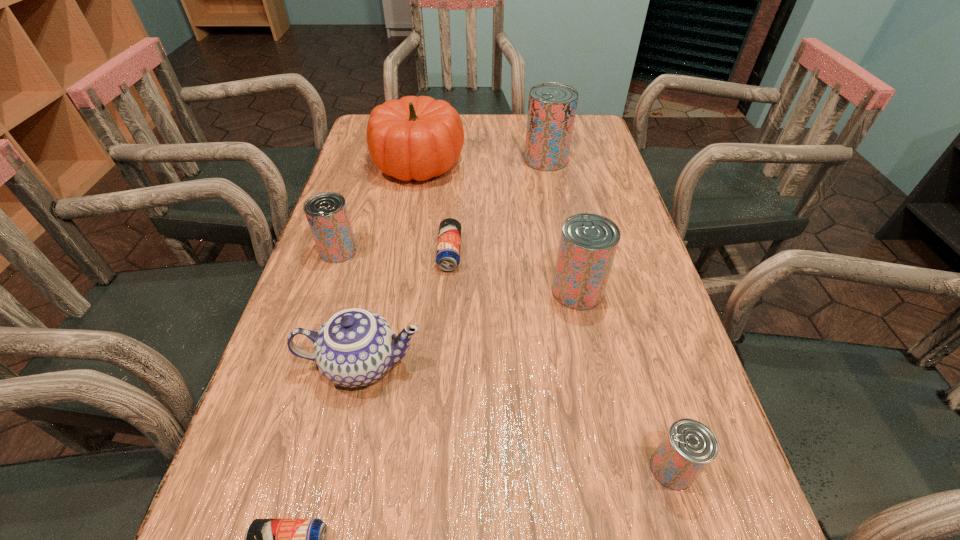
Locate an element on the screen. beer can positioned at the far edge is located at coordinates (552, 106).

Image resolution: width=960 pixels, height=540 pixels. In order to click on pumpkin situated at the far edge in this screenshot , I will do `click(419, 138)`.

Locate an element on the screen. The width and height of the screenshot is (960, 540). pumpkin present at the left edge is located at coordinates (419, 138).

Locate an element on the screen. Image resolution: width=960 pixels, height=540 pixels. chinaware at the left edge is located at coordinates (355, 347).

At what (x,y) coordinates should I click in order to perform the action: click on beer can located at the left edge. Please return your answer as a coordinate pair (x, y). The image size is (960, 540). Looking at the image, I should click on (327, 214).

Identify the location of object located at the far left corner. The width and height of the screenshot is (960, 540). (419, 138).

Where is `object situated at the far right corner`? object situated at the far right corner is located at coordinates (552, 106).

Identify the location of vacant space at the far edge. The image size is (960, 540). (506, 121).

The image size is (960, 540). What are the coordinates of `vacant space at the left edge of the desktop` in the screenshot? It's located at (269, 372).

In the image, there is a desktop. At what (x,y) coordinates should I click in order to perform the action: click on free space at the right edge. Please return your answer as a coordinate pair (x, y). The width and height of the screenshot is (960, 540). Looking at the image, I should click on (632, 251).